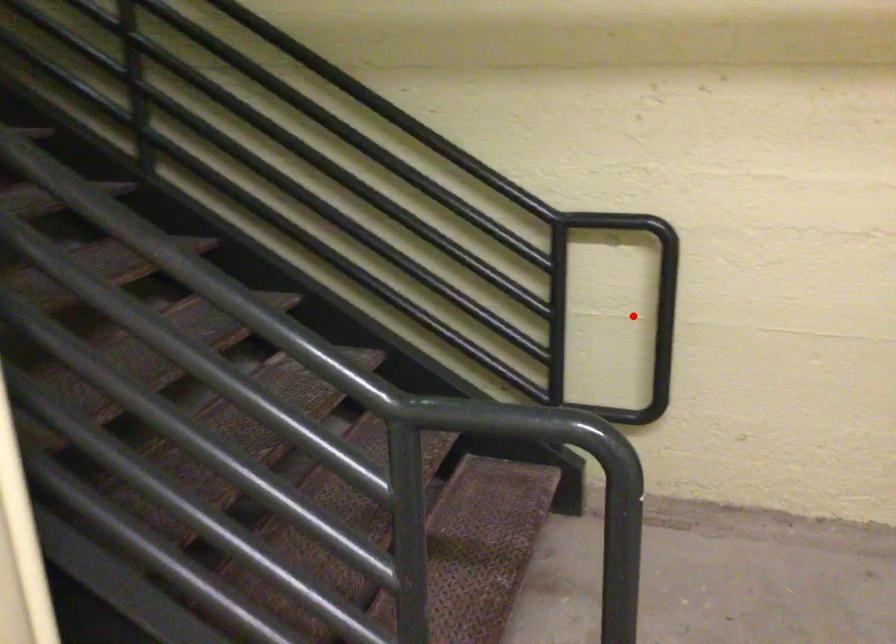
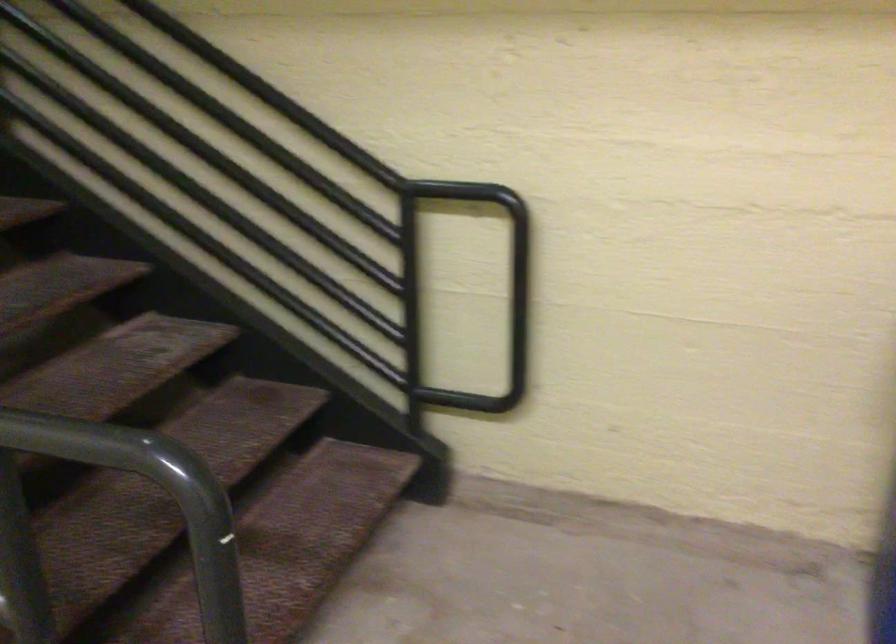
The point at the highlighted location is marked in the first image. Where is the corresponding point in the second image?

(495, 301)